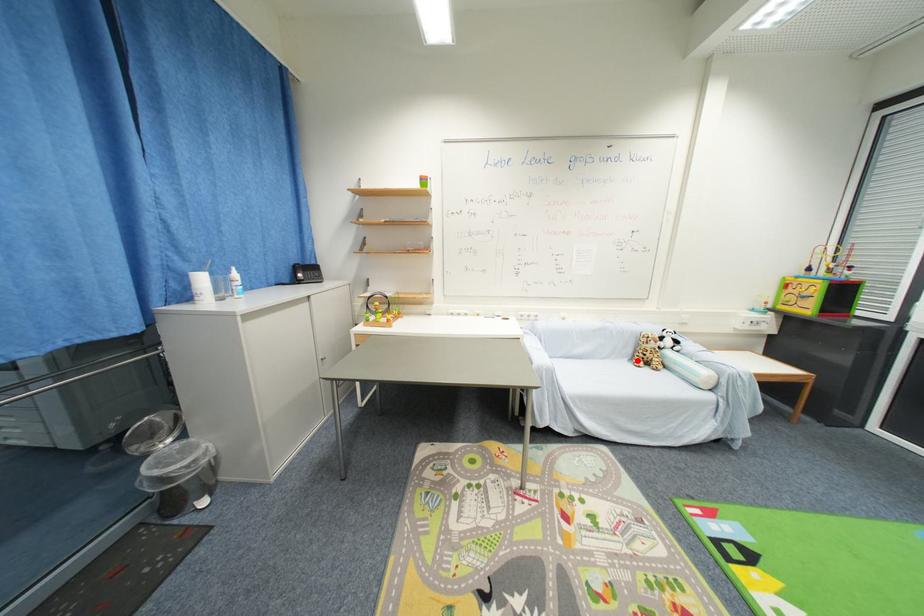
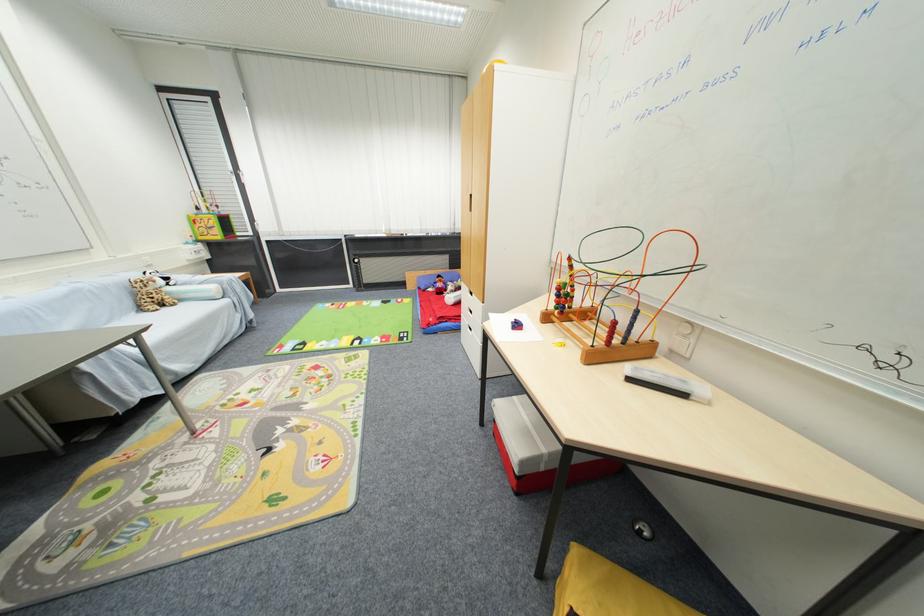
Locate, in the second image, the point that corresponds to the highlighted location in the first image.

(146, 310)